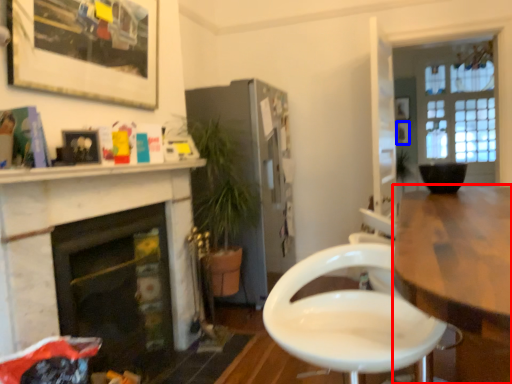
Question: Which of the following is the farthest to the observer, kitchen & dining room table (highlighted by a red box) or picture frame (highlighted by a blue box)?

Choices:
 (A) kitchen & dining room table
 (B) picture frame

Answer: (B)